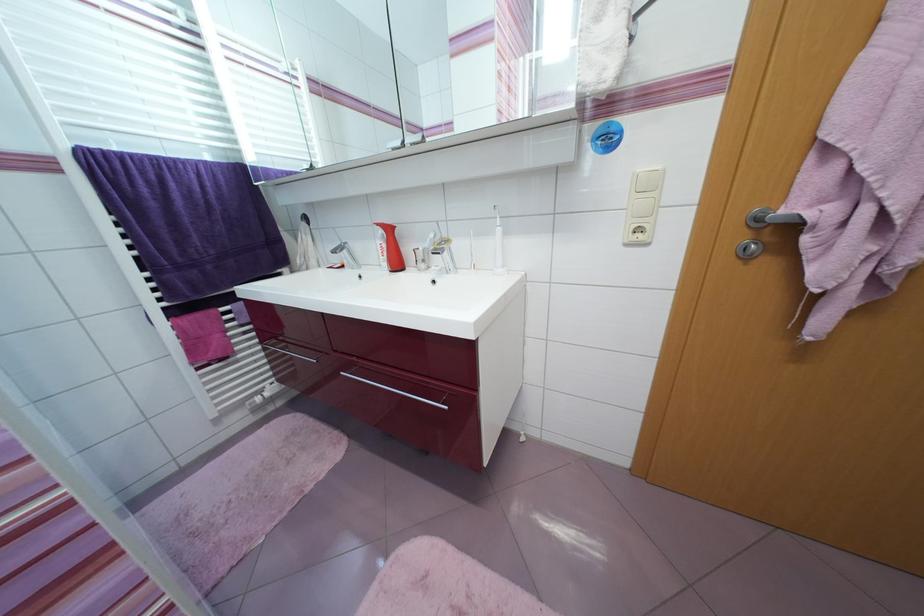
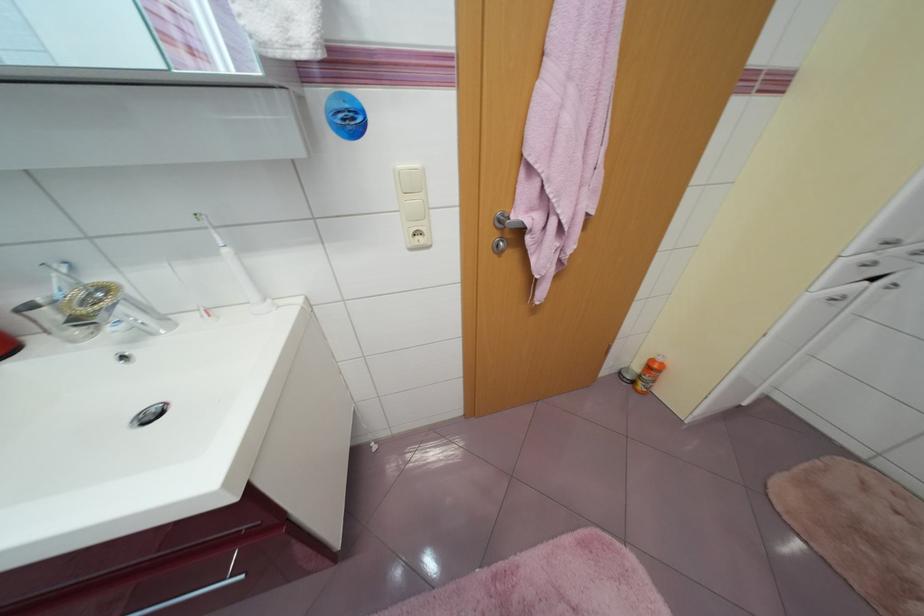
Locate, in the second image, the point that corresponds to [642,236] in the first image.

(423, 238)